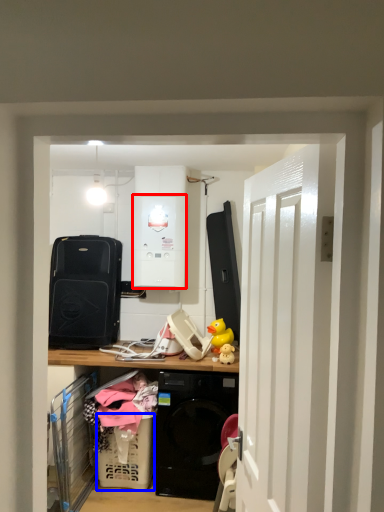
Question: Among these objects, which one is farthest to the camera, appliance (highlighted by a red box) or basket (highlighted by a blue box)?

Choices:
 (A) appliance
 (B) basket

Answer: (A)